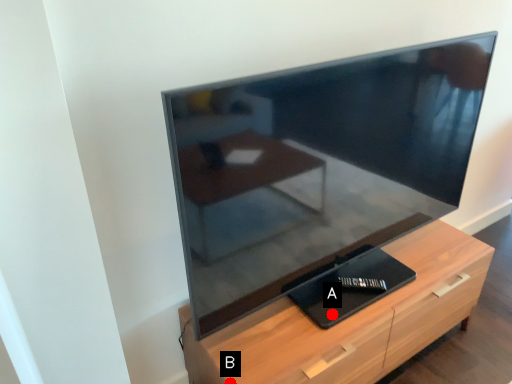
Question: Two points are circled on the image, labeled by A and B beside each circle. Which point is farther from the camera taking this photo?

Choices:
 (A) A is further
 (B) B is further

Answer: (A)